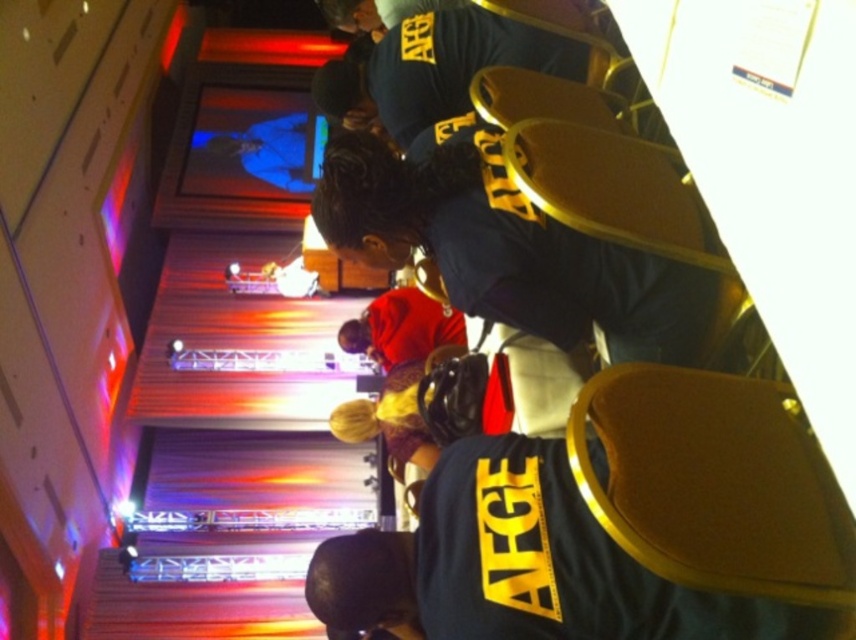
You are an event planner organizing a photo shoot at this indoor event venue. You need to place a large backdrop behind the dark blue shirt at center and the red velvet jacket at center. Which object should you position the backdrop behind to ensure it covers both without overlapping either?

The dark blue shirt at center is positioned over the red velvet jacket at center. To cover both without overlapping, place the backdrop behind the red velvet jacket at center since it is behind the dark blue shirt at center.

Looking at this image, you are an event organizer arranging seating for a photo opportunity. You need to place two individuals wearing the dark blue shirt at center and the red velvet jacket at center in the front row. Considering their heights, which individual should be positioned on the left side to ensure everyone can see the stage?

The dark blue shirt at center is taller than the red velvet jacket at center. To ensure visibility, the taller individual wearing the dark blue shirt at center should be positioned on the left side so that the shorter person in the red velvet jacket at center can see over them.